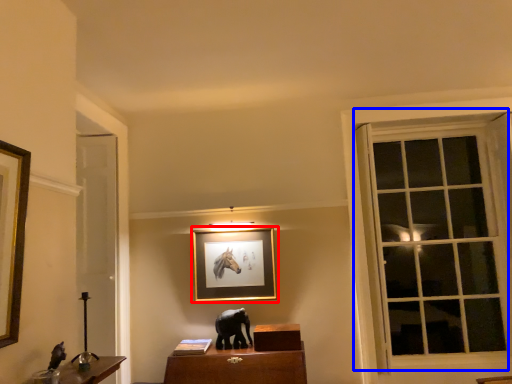
Question: Among these objects, which one is nearest to the camera, picture frame (highlighted by a red box) or window (highlighted by a blue box)?

Choices:
 (A) picture frame
 (B) window

Answer: (B)